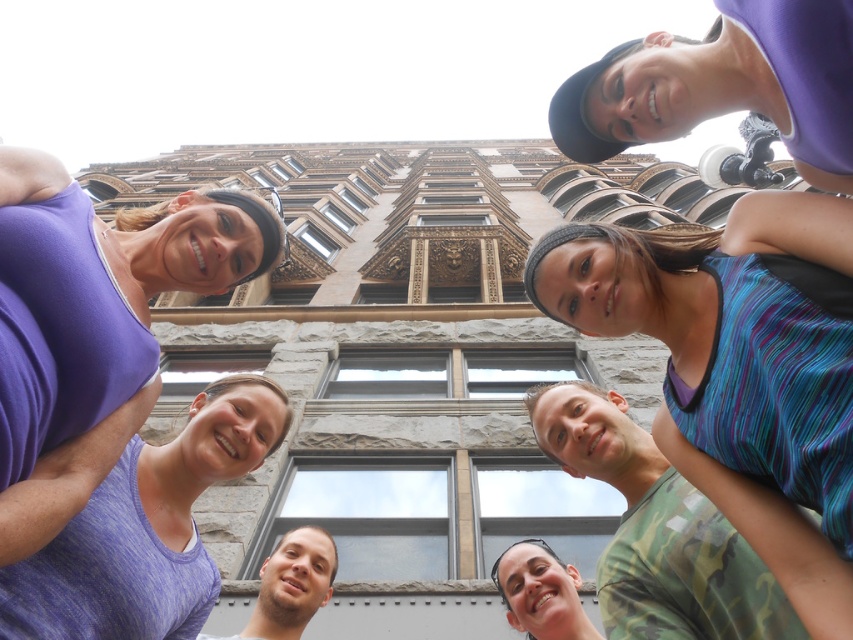
Question: Can you confirm if purple fabric tank top at upper left is positioned to the left of matte green shirt at center?

Choices:
 (A) yes
 (B) no

Answer: (A)

Question: Among these points, which one is nearest to the camera?

Choices:
 (A) (181, 589)
 (B) (753, 282)
 (C) (547, 604)

Answer: (B)

Question: Where is matte green shirt at center located in relation to matte black hair at lower center in the image?

Choices:
 (A) left
 (B) right

Answer: (A)

Question: Which of the following is the farthest from the observer?

Choices:
 (A) camouflage fabric shirt at lower right
 (B) matte black hair at lower center

Answer: (B)

Question: Is purple heather tank top at upper left to the right of camouflage fabric shirt at lower right from the viewer's perspective?

Choices:
 (A) no
 (B) yes

Answer: (A)

Question: Which point is farther from the camera taking this photo?

Choices:
 (A) (822, 364)
 (B) (259, 241)
 (C) (274, 605)

Answer: (B)